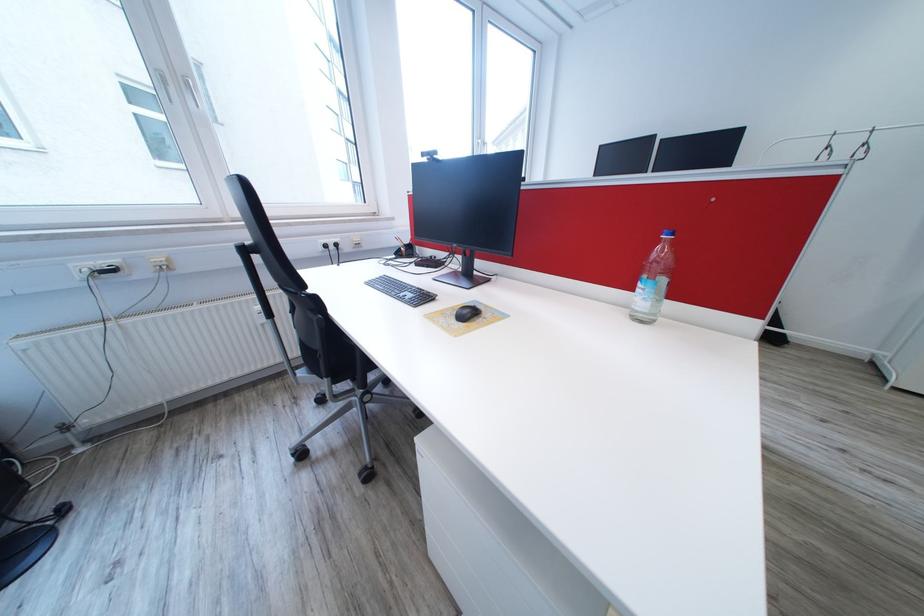
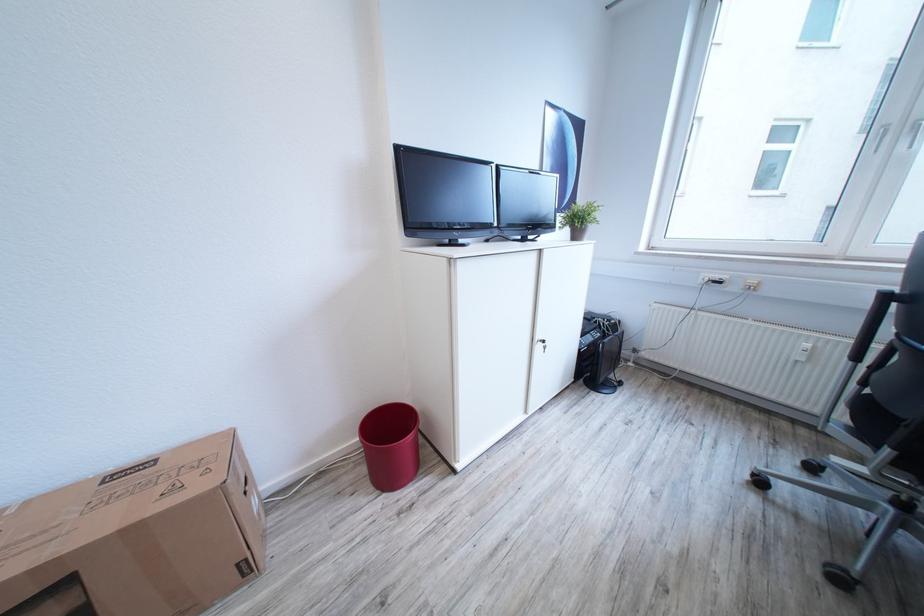
In the second image, find the point that corresponds to (x=163, y=262) in the first image.

(759, 284)